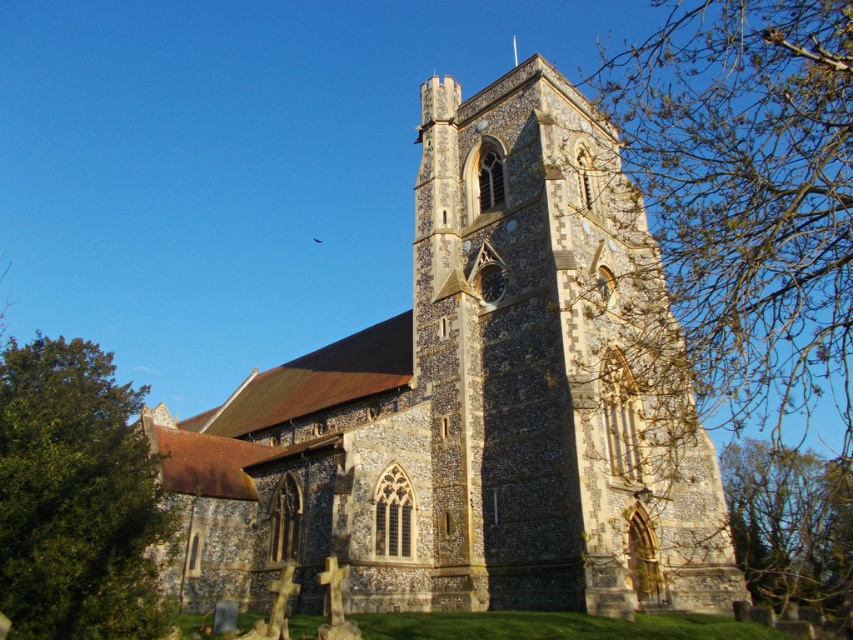
Question: Which point is farther from the camera taking this photo?

Choices:
 (A) (753, 300)
 (B) (807, 557)

Answer: (B)

Question: Where is bare branches at upper right located in relation to green leafy tree at lower left in the image?

Choices:
 (A) below
 (B) above

Answer: (B)

Question: Which point is closer to the camera?

Choices:
 (A) (712, 266)
 (B) (788, 518)
 (C) (122, 502)

Answer: (C)

Question: Is green leafy tree at lower left below green leafy tree at lower right?

Choices:
 (A) yes
 (B) no

Answer: (B)

Question: Is brown stone church at center below green leafy tree at lower left?

Choices:
 (A) yes
 (B) no

Answer: (B)

Question: Which point is farther to the camera?

Choices:
 (A) (755, 532)
 (B) (91, 636)

Answer: (A)